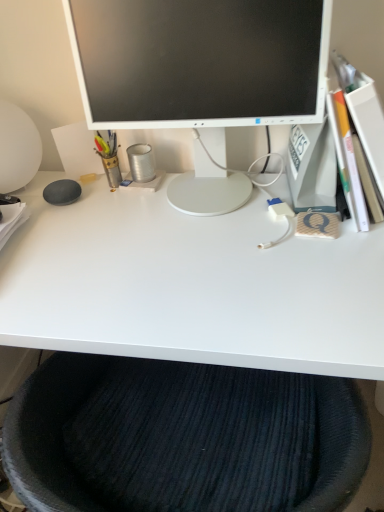
This screenshot has height=512, width=384. I want to click on free point above dark blue textured cushion at lower center (from a real-world perspective), so click(195, 307).